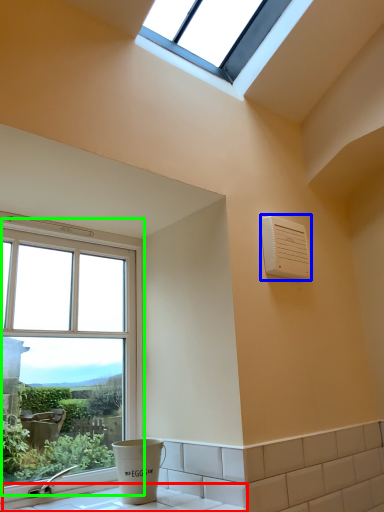
Question: Estimate the real-world distances between objects in this image. Which object is farther from counter top (highlighted by a red box), air conditioning (highlighted by a blue box) or window (highlighted by a green box)?

Choices:
 (A) air conditioning
 (B) window

Answer: (A)